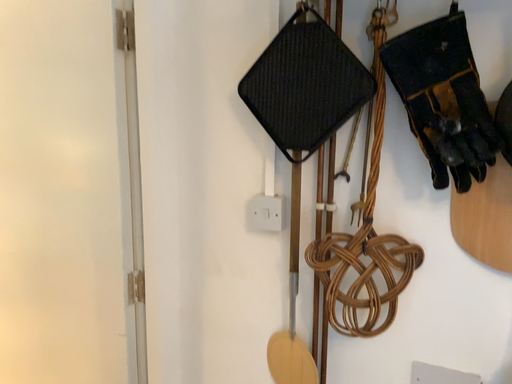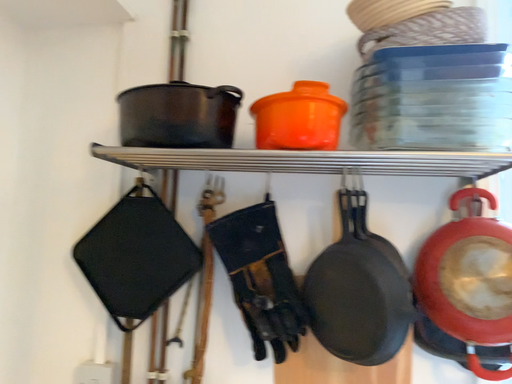
Question: How did the camera likely rotate when shooting the video?

Choices:
 (A) rotated right
 (B) rotated left

Answer: (A)